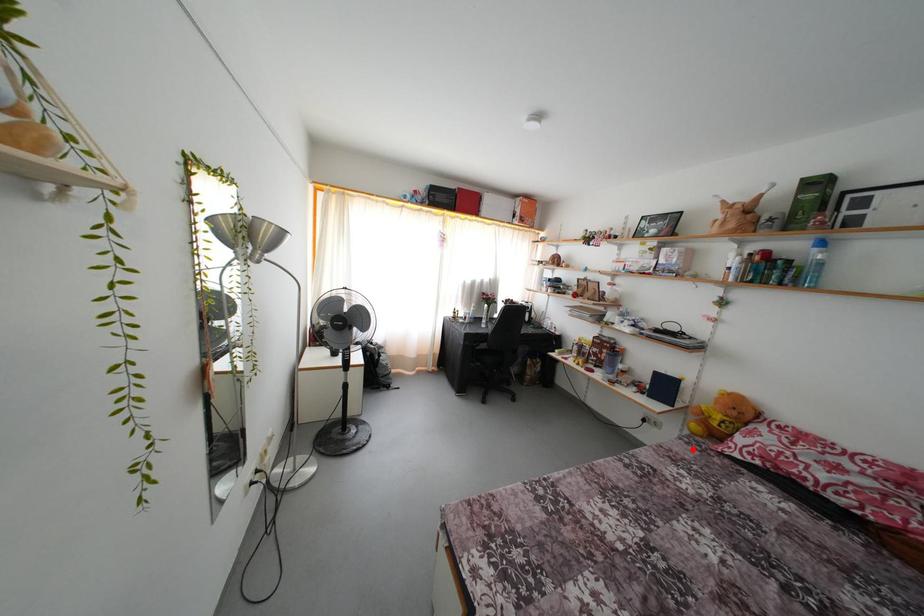
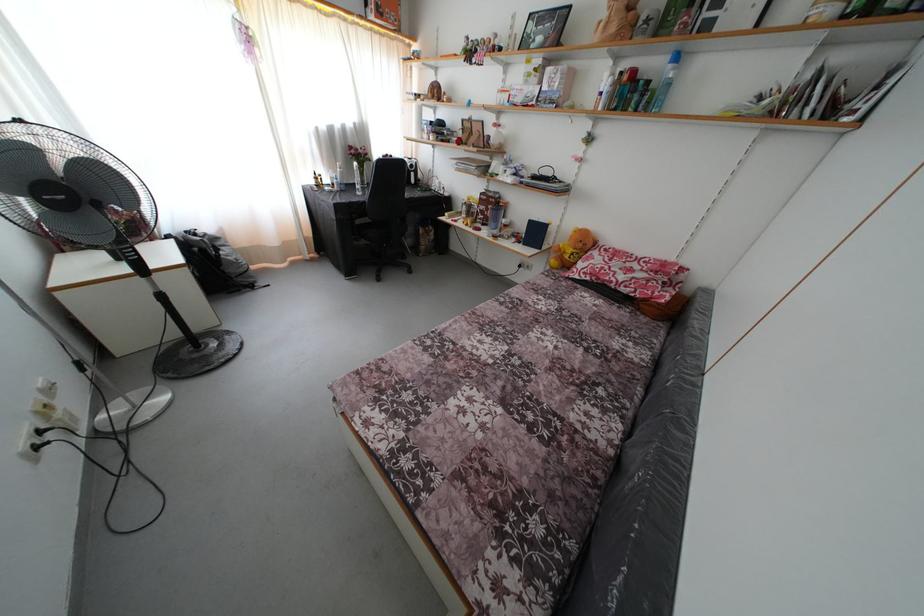
The point at the highlighted location is marked in the first image. Where is the corresponding point in the second image?

(552, 282)